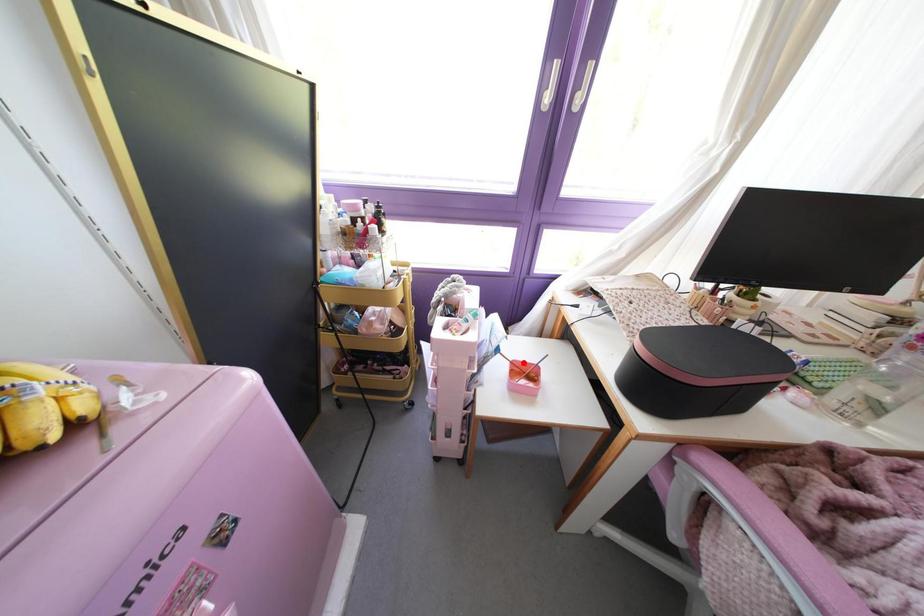
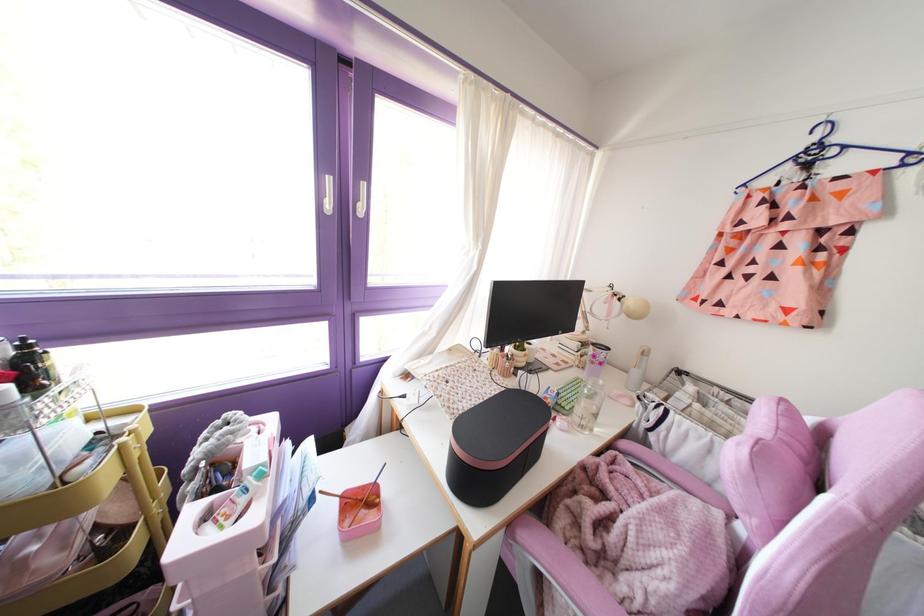
The point at the highlighted location is marked in the first image. Where is the corresponding point in the second image?

(359, 487)